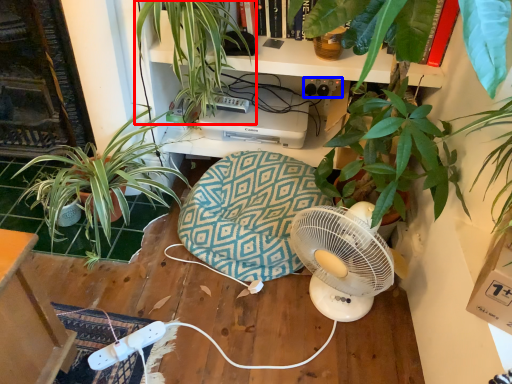
Question: Which of the following is the closest to the observer, houseplant (highlighted by a red box) or plug (highlighted by a blue box)?

Choices:
 (A) houseplant
 (B) plug

Answer: (A)